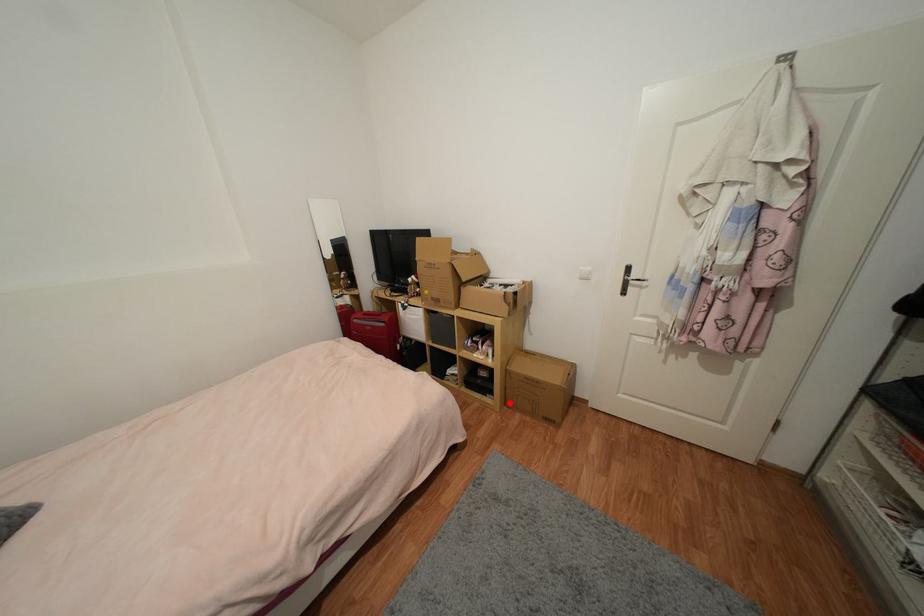
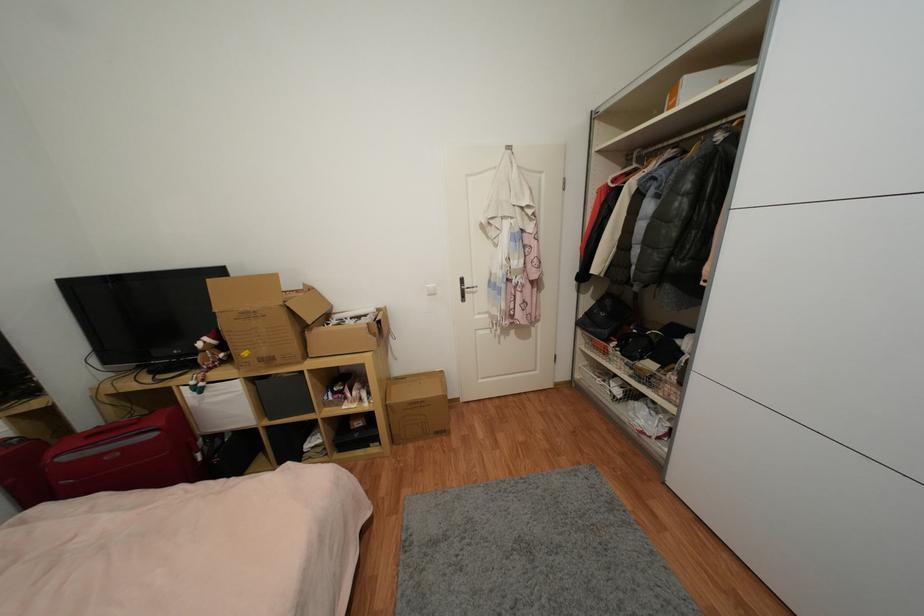
Question: I am providing you with two images of the same scene from different viewpoints. In image1, a red point is highlighted. Considering the same 3D point in image2, which of the following is correct?

Choices:
 (A) It is closer
 (B) It is farther

Answer: (B)